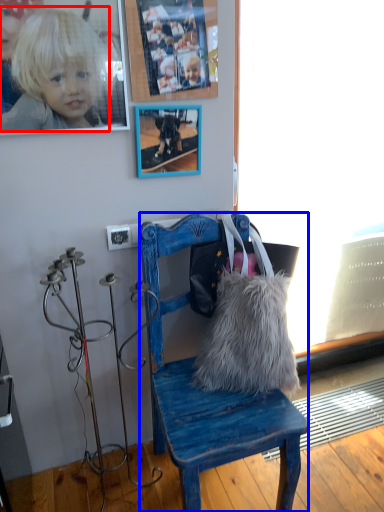
Question: Which object appears closest to the camera in this image, person (highlighted by a red box) or chair (highlighted by a blue box)?

Choices:
 (A) person
 (B) chair

Answer: (B)